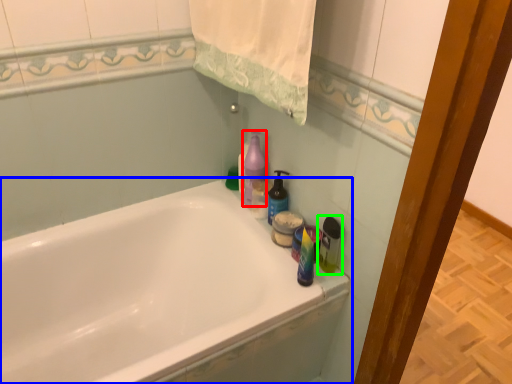
Question: Which object is the farthest from cleaning product (highlighted by a red box)? Choose among these: bathtub (highlighted by a blue box) or cleaning product (highlighted by a green box).

Choices:
 (A) bathtub
 (B) cleaning product

Answer: (A)